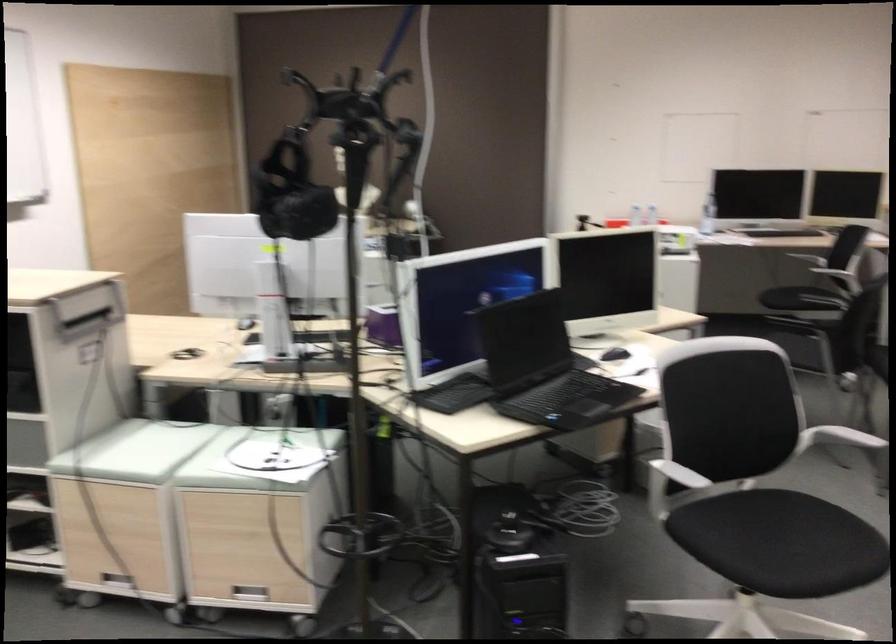
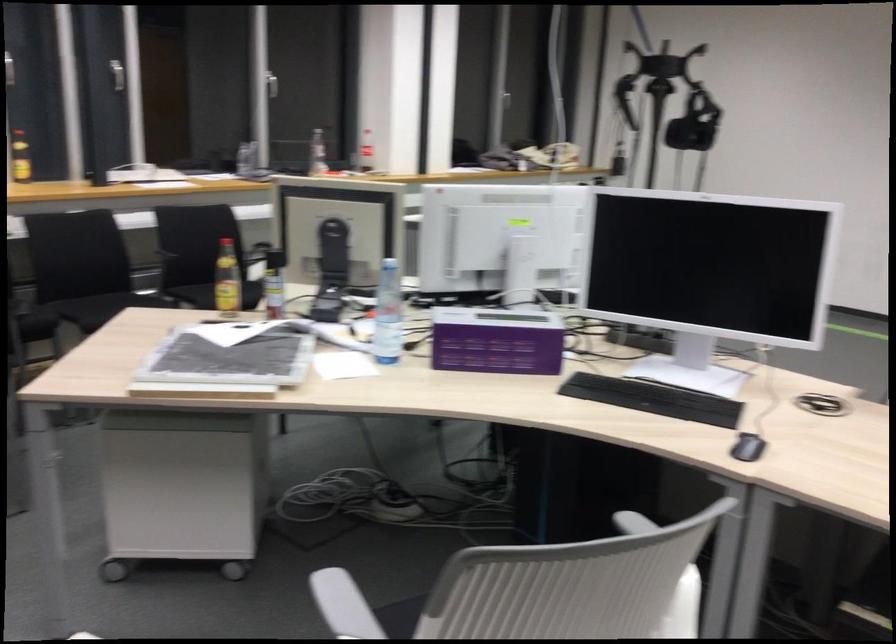
Where in the second image is the point corresponding to the point at 390,316 from the first image?

(495, 341)